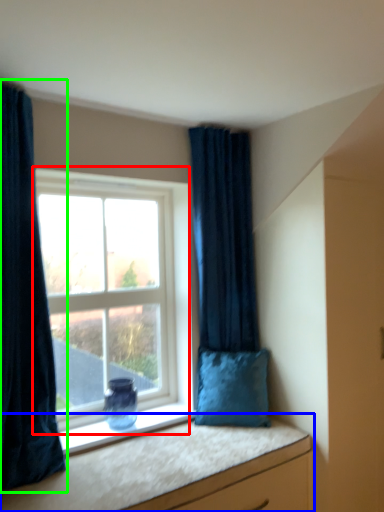
Question: Based on their relative distances, which object is nearer to window (highlighted by a red box)? Choose from vanity (highlighted by a blue box) and curtain (highlighted by a green box).

Choices:
 (A) vanity
 (B) curtain

Answer: (B)